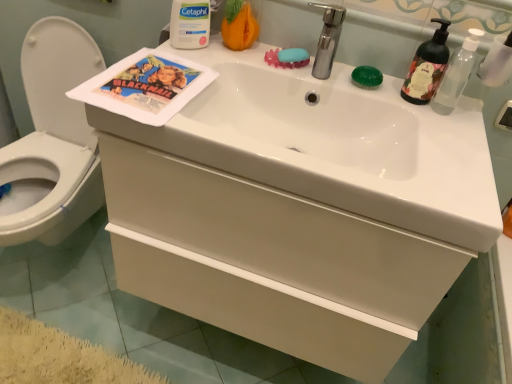
Image resolution: width=512 pixels, height=384 pixels. In order to click on vacant area that is situated to the right of green matte soap at upper right, acting as the second soap starting from the left in this screenshot , I will do `click(421, 100)`.